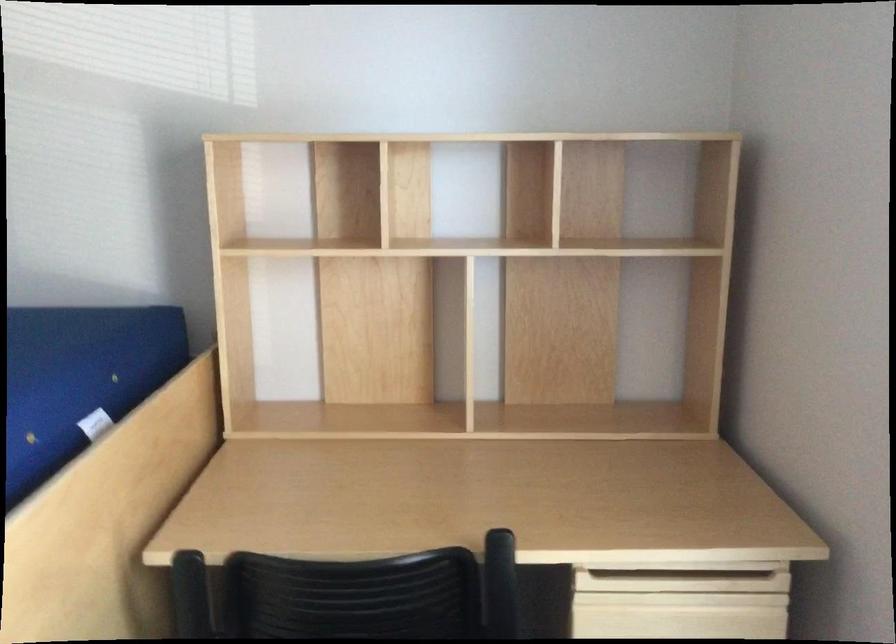
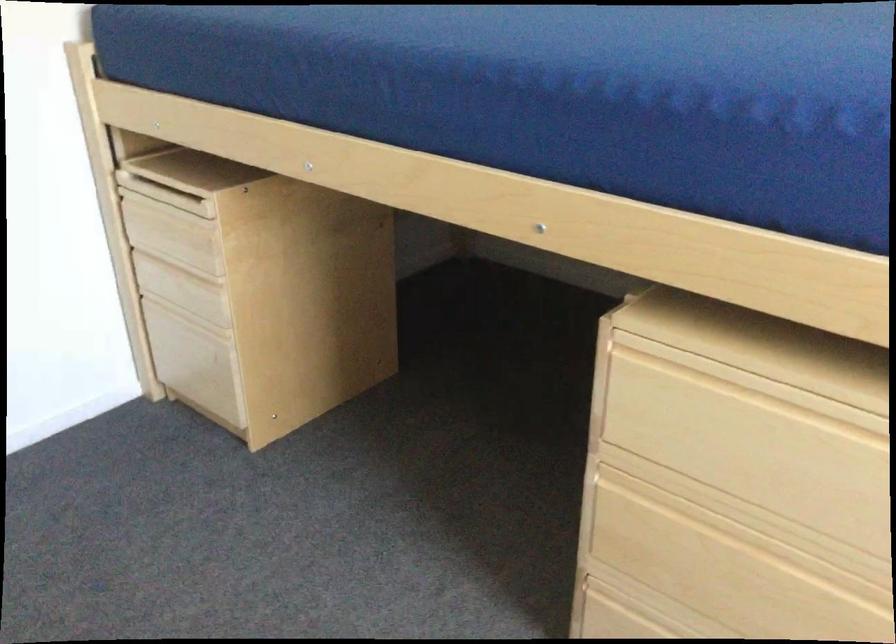
The images are taken continuously from a first-person perspective. In which direction is your viewpoint rotating?

The camera rotated toward left-down.